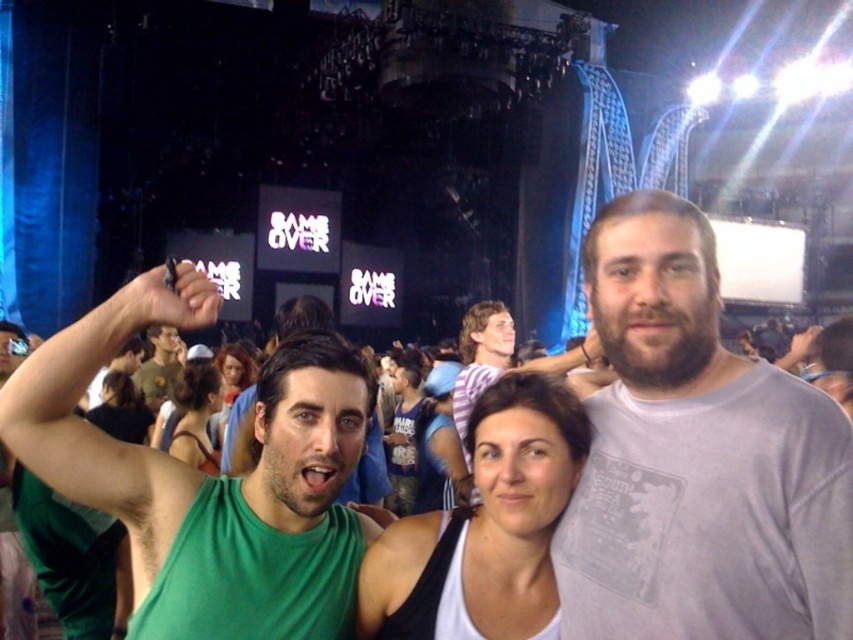
Question: Is matte blue tank top at center positioned at the back of smooth brown hair at center?

Choices:
 (A) no
 (B) yes

Answer: (B)

Question: Does green matte tank top at left appear over smooth black tank top at center?

Choices:
 (A) yes
 (B) no

Answer: (A)

Question: Estimate the real-world distances between objects in this image. Which object is closer to the smooth black tank top at center?

Choices:
 (A) dark brown hair at center
 (B) gray cotton t-shirt at center
 (C) matte blue tank top at center
 (D) white matte tank top at center

Answer: (C)

Question: Which point is farther to the camera?

Choices:
 (A) matte blue tank top at center
 (B) smooth brown hair at center
 (C) dark brown hair at center
 (D) smooth black tank top at center

Answer: (A)

Question: In this image, where is white matte tank top at center located relative to smooth black tank top at center?

Choices:
 (A) below
 (B) above

Answer: (A)

Question: Which point is closer to the camera?

Choices:
 (A) (428, 492)
 (B) (340, 368)

Answer: (B)